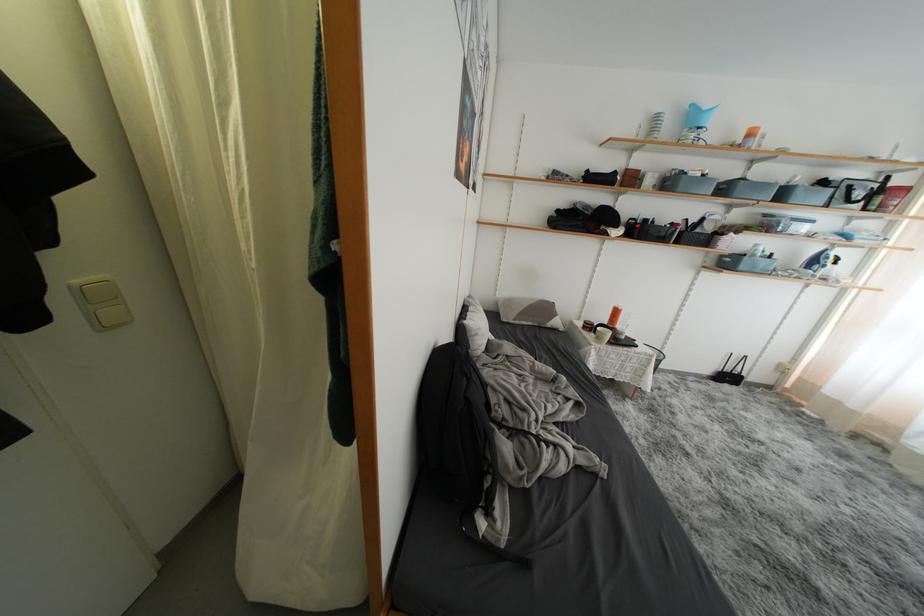
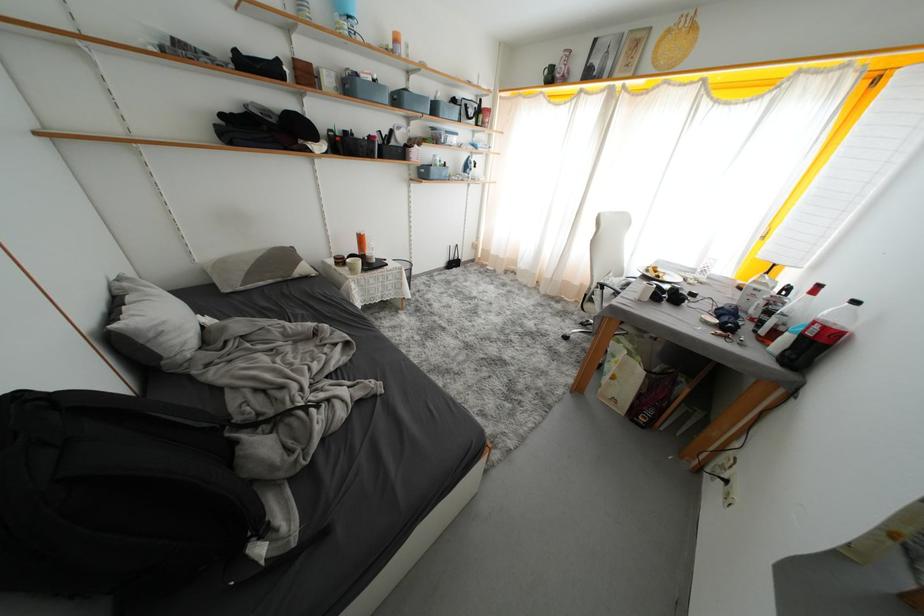
Find the pixel in the second image that matches [710,179] in the first image.

(381, 84)